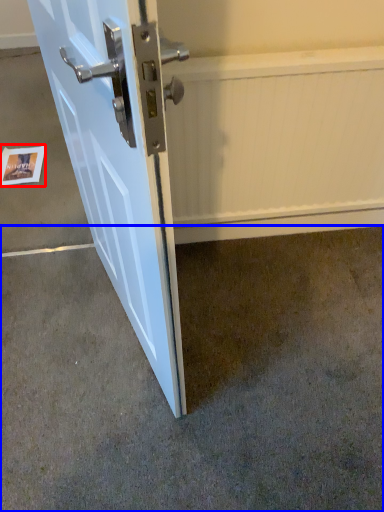
Question: Which object appears farthest to the camera in this image, postcard (highlighted by a red box) or concrete (highlighted by a blue box)?

Choices:
 (A) postcard
 (B) concrete

Answer: (A)